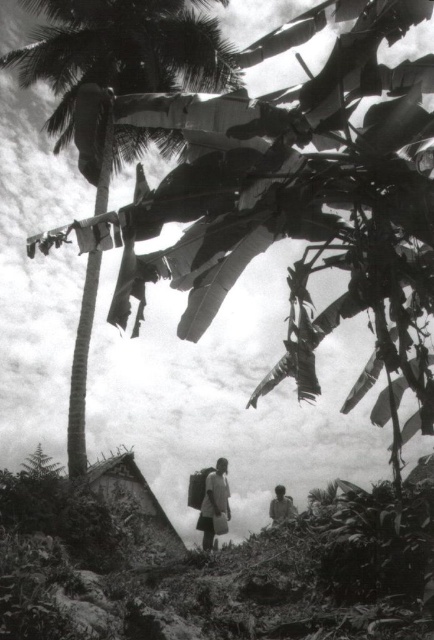
Question: Is smooth brown palm tree at center above light brown fabric shirt at lower right?

Choices:
 (A) yes
 (B) no

Answer: (A)

Question: Is matte white backpack at center to the left of light brown fabric shirt at lower right from the viewer's perspective?

Choices:
 (A) no
 (B) yes

Answer: (B)

Question: Can you confirm if matte white backpack at center is thinner than light brown fabric shirt at lower right?

Choices:
 (A) yes
 (B) no

Answer: (B)

Question: Which of these objects is positioned closest to the light brown fabric shirt at lower right?

Choices:
 (A) matte white backpack at center
 (B) smooth brown palm tree at center

Answer: (A)

Question: Which of the following is the farthest from the observer?

Choices:
 (A) smooth brown palm tree at center
 (B) light brown fabric shirt at lower right

Answer: (B)

Question: Which point appears farthest from the camera in this image?

Choices:
 (A) (29, 4)
 (B) (213, 497)

Answer: (A)